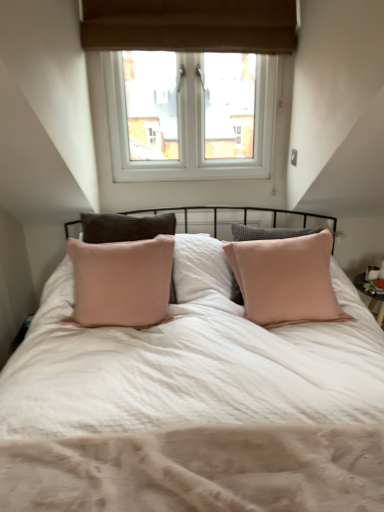
Question: Based on their positions, is beige textured mattress at center located to the left or right of white plastic window at upper center?

Choices:
 (A) left
 (B) right

Answer: (B)

Question: From their relative heights in the image, would you say beige textured mattress at center is taller or shorter than white plastic window at upper center?

Choices:
 (A) tall
 (B) short

Answer: (B)

Question: Choose the correct answer: Is beige textured mattress at center inside white plastic window at upper center or outside it?

Choices:
 (A) outside
 (B) inside

Answer: (A)

Question: Is white plastic window at upper center taller or shorter than beige textured mattress at center?

Choices:
 (A) short
 (B) tall

Answer: (B)

Question: Does point (246, 23) appear closer or farther from the camera than point (81, 506)?

Choices:
 (A) closer
 (B) farther

Answer: (B)

Question: Which is correct: white plastic window at upper center is inside beige textured mattress at center, or outside of it?

Choices:
 (A) inside
 (B) outside

Answer: (B)

Question: From a real-world perspective, relative to beige textured mattress at center, is white plastic window at upper center vertically above or below?

Choices:
 (A) below
 (B) above

Answer: (B)